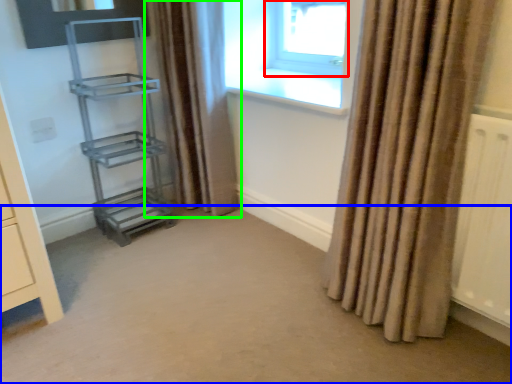
Question: Which is nearer to the window (highlighted by a red box)? plain (highlighted by a blue box) or curtain (highlighted by a green box).

Choices:
 (A) plain
 (B) curtain

Answer: (B)